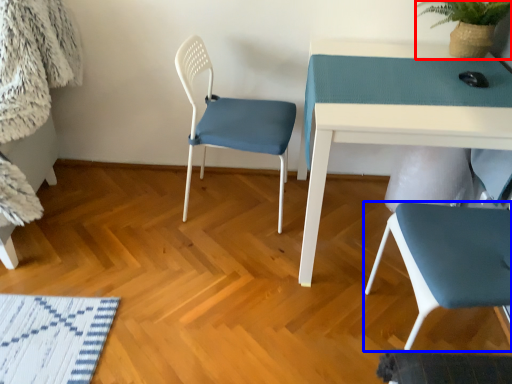
Question: Among these objects, which one is farthest to the camera, plant (highlighted by a red box) or chair (highlighted by a blue box)?

Choices:
 (A) plant
 (B) chair

Answer: (A)